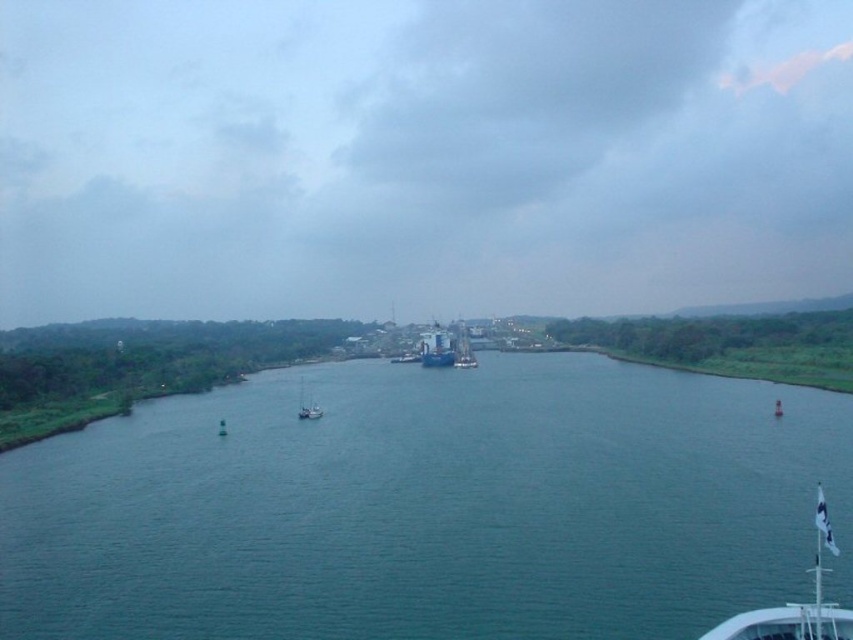
Question: Does blue water at center have a larger size compared to white matte sailboat at center?

Choices:
 (A) yes
 (B) no

Answer: (A)

Question: Observing the image, what is the correct spatial positioning of white flag at lower right in reference to blue metallic ship at center?

Choices:
 (A) left
 (B) right

Answer: (B)

Question: Estimate the real-world distances between objects in this image. Which object is farther from the blue water at center?

Choices:
 (A) blue matte ship at center
 (B) white flag at lower right

Answer: (A)

Question: Which object is positioned farthest from the blue water at center?

Choices:
 (A) white matte sailboat at center
 (B) blue matte ship at center
 (C) white flag at lower right
 (D) blue metallic ship at center

Answer: (B)

Question: Is blue water at center bigger than white matte sailboat at center?

Choices:
 (A) no
 (B) yes

Answer: (B)

Question: Among these objects, which one is farthest from the camera?

Choices:
 (A) white matte sailboat at center
 (B) blue matte ship at center
 (C) blue water at center
 (D) white flag at lower right

Answer: (B)